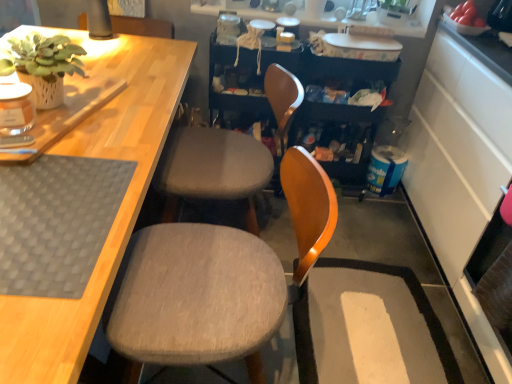
The width and height of the screenshot is (512, 384). I want to click on free point above gray woven mat at lower left (from a real-world perspective), so click(x=47, y=203).